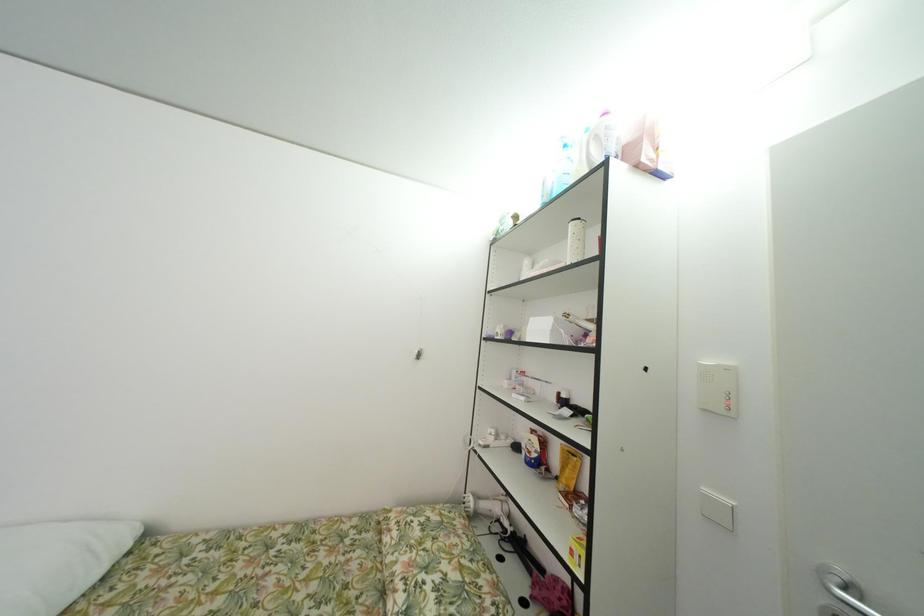
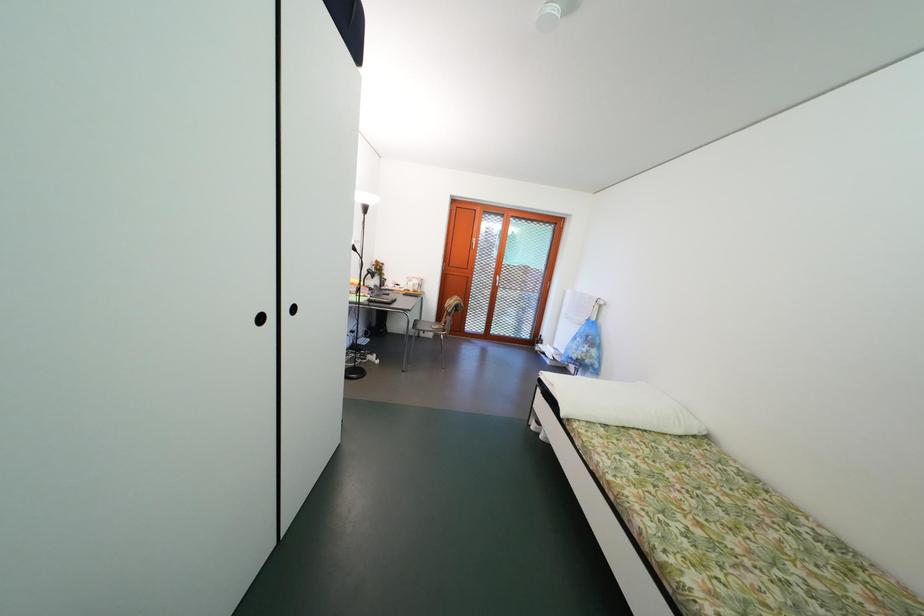
Question: The first image is from the beginning of the video and the second image is from the end. How did the camera likely rotate when shooting the video?

Choices:
 (A) Left
 (B) Right
 (C) Up
 (D) Down

Answer: (A)